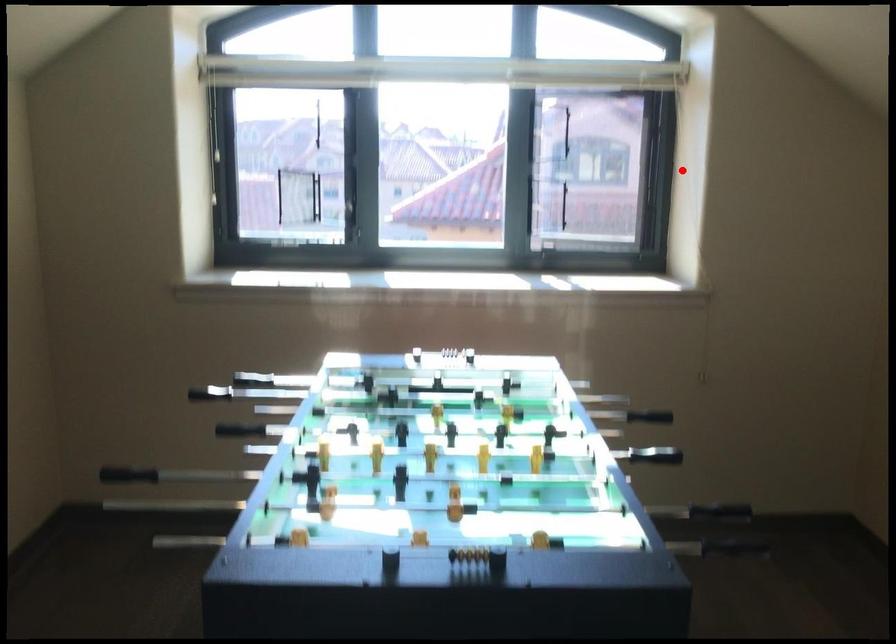
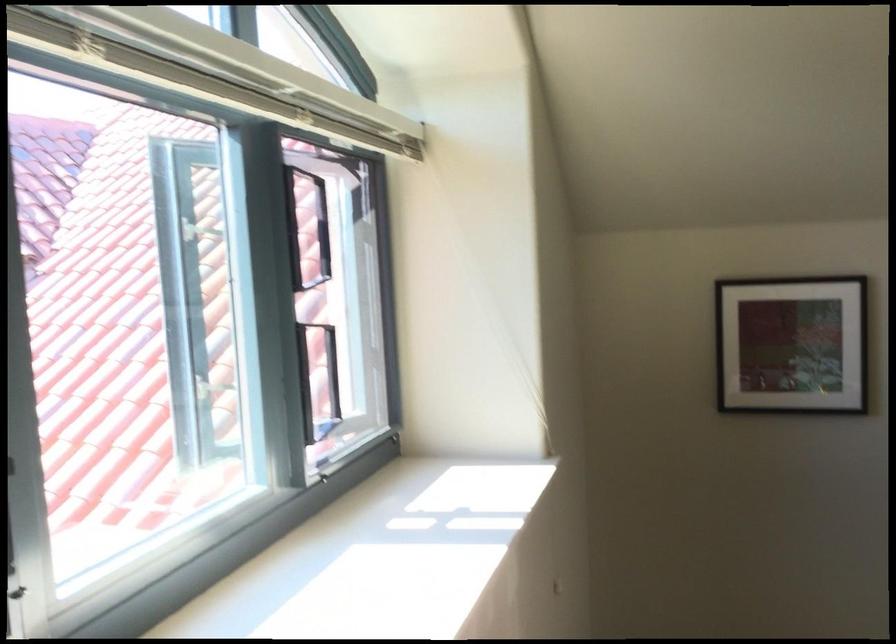
Where in the second image is the point corresponding to the highlighted location from the first image?

(483, 298)